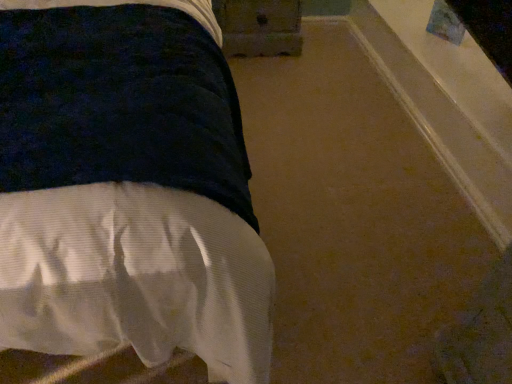
In the scene shown: Measure the distance between point (278, 43) and camera.

Point (278, 43) is 2.23 meters away from camera.

At what (x,y) coordinates should I click in order to perform the action: click on wooden drawer at upper center. Please return your answer as a coordinate pair (x, y). The width and height of the screenshot is (512, 384). Looking at the image, I should click on (259, 27).

What do you see at coordinates (259, 27) in the screenshot? I see `wooden drawer at upper center` at bounding box center [259, 27].

What are the coordinates of `white textured bed at left` in the screenshot? It's located at (127, 188).

What is the approximate height of white textured bed at left?

The height of white textured bed at left is 3.42 centimeters.

Image resolution: width=512 pixels, height=384 pixels. What do you see at coordinates (127, 188) in the screenshot?
I see `white textured bed at left` at bounding box center [127, 188].

Locate an element on the screen. The height and width of the screenshot is (384, 512). wooden drawer at upper center is located at coordinates (259, 27).

Considering the relative positions of wooden drawer at upper center and white textured bed at left in the image provided, is wooden drawer at upper center to the right of white textured bed at left from the viewer's perspective?

Correct, you'll find wooden drawer at upper center to the right of white textured bed at left.

Who is more distant, wooden drawer at upper center or white textured bed at left?

wooden drawer at upper center is more distant.

Which is nearer, (240, 5) or (22, 331)?

Clearly, point (240, 5) is more distant from the camera than point (22, 331).

From the image's perspective, is wooden drawer at upper center above or below white textured bed at left?

wooden drawer at upper center is situated higher than white textured bed at left in the image.

From a real-world perspective, does wooden drawer at upper center sit lower than white textured bed at left?

No, from a real-world perspective, wooden drawer at upper center is not below white textured bed at left.

Considering the relative sizes of wooden drawer at upper center and white textured bed at left in the image provided, is wooden drawer at upper center wider than white textured bed at left?

In fact, wooden drawer at upper center might be narrower than white textured bed at left.

From the picture: Between wooden drawer at upper center and white textured bed at left, which one has more height?

Standing taller between the two is wooden drawer at upper center.

Which of these two, wooden drawer at upper center or white textured bed at left, is bigger?

white textured bed at left.

Which is correct: wooden drawer at upper center is inside white textured bed at left, or outside of it?

wooden drawer at upper center cannot be found inside white textured bed at left.

Are wooden drawer at upper center and white textured bed at left far apart?

Yes, wooden drawer at upper center and white textured bed at left are quite far apart.

Is wooden drawer at upper center oriented away from white textured bed at left?

That's not correct — wooden drawer at upper center is not looking away from white textured bed at left.

Can you tell me how much wooden drawer at upper center and white textured bed at left differ in facing direction?

89.7 degrees separate the facing orientations of wooden drawer at upper center and white textured bed at left.

In order to click on drawer above the white textured bed at left (from a real-world perspective) in this screenshot , I will do `click(259, 27)`.

In the image, is white textured bed at left on the left side or the right side of wooden drawer at upper center?

Based on their positions, white textured bed at left is located to the left of wooden drawer at upper center.

Looking at this image, considering their positions, is white textured bed at left located in front of or behind wooden drawer at upper center?

white textured bed at left is positioned closer to the viewer than wooden drawer at upper center.

Which is less distant, (x=154, y=123) or (x=259, y=25)?

Point (x=154, y=123) is positioned closer to the camera compared to point (x=259, y=25).

From the image's perspective, which is above, white textured bed at left or wooden drawer at upper center?

wooden drawer at upper center, from the image's perspective.

From a real-world perspective, is white textured bed at left located higher than wooden drawer at upper center?

Incorrect, from a real-world perspective, white textured bed at left is lower than wooden drawer at upper center.

In terms of width, does white textured bed at left look wider or thinner when compared to wooden drawer at upper center?

Considering their sizes, white textured bed at left looks broader than wooden drawer at upper center.

Does white textured bed at left have a greater height compared to wooden drawer at upper center?

In fact, white textured bed at left may be shorter than wooden drawer at upper center.

Considering the sizes of objects white textured bed at left and wooden drawer at upper center in the image provided, who is bigger, white textured bed at left or wooden drawer at upper center?

white textured bed at left is bigger.

Which is correct: white textured bed at left is inside wooden drawer at upper center, or outside of it?

white textured bed at left cannot be found inside wooden drawer at upper center.

Is white textured bed at left next to wooden drawer at upper center and touching it?

white textured bed at left and wooden drawer at upper center are clearly separated.

Is white textured bed at left facing away from wooden drawer at upper center?

No.

How different are the orientations of white textured bed at left and wooden drawer at upper center in degrees?

The angle between the facing direction of white textured bed at left and the facing direction of wooden drawer at upper center is 89.7 degrees.

How much distance is there between white textured bed at left and wooden drawer at upper center?

white textured bed at left is 4.37 feet away from wooden drawer at upper center.

In order to click on drawer above the white textured bed at left (from a real-world perspective) in this screenshot , I will do `click(259, 27)`.

The image size is (512, 384). I want to click on bed lying on the left of wooden drawer at upper center, so click(x=127, y=188).

Image resolution: width=512 pixels, height=384 pixels. In order to click on bed in front of the wooden drawer at upper center in this screenshot , I will do `click(127, 188)`.